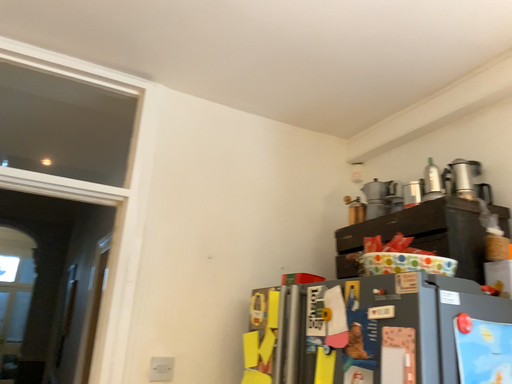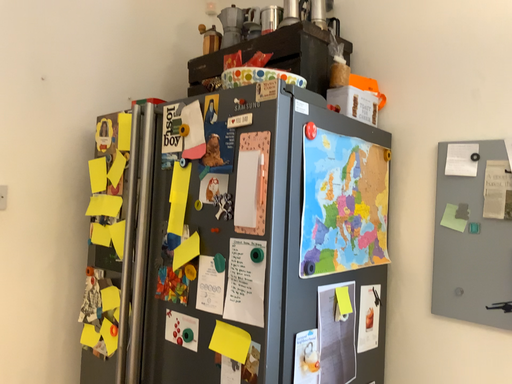
Question: Which way did the camera rotate in the video?

Choices:
 (A) rotated upward
 (B) rotated downward

Answer: (B)